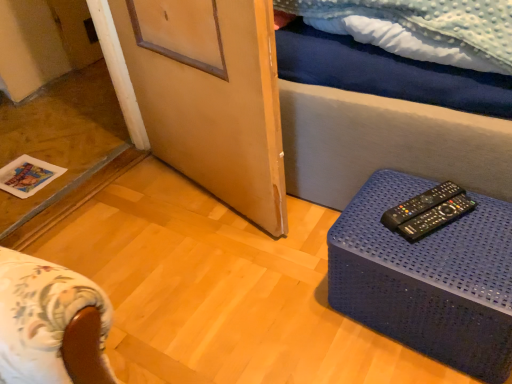
Question: Looking at the image, does blue plastic table at lower right seem bigger or smaller compared to black plastic remote control at right, positioned as the 1th remote control in back-to-front order?

Choices:
 (A) small
 (B) big

Answer: (B)

Question: In the image, is blue plastic table at lower right on the left side or the right side of black plastic remote control at right, the 2th remote control when ordered from front to back?

Choices:
 (A) right
 (B) left

Answer: (A)

Question: Considering the real-world distances, which object is farthest from the wooden screen door at center?

Choices:
 (A) black plastic remote controls at right, arranged as the 2th remote control when viewed from the back
 (B) black plastic remote control at right, positioned as the 1th remote control in back-to-front order
 (C) blue plastic table at lower right

Answer: (A)

Question: Estimate the real-world distances between objects in this image. Which object is farther from the black plastic remote controls at right, which ranks as the 1th remote control in front-to-back order?

Choices:
 (A) black plastic remote control at right, the 2th remote control when ordered from front to back
 (B) wooden screen door at center
 (C) blue plastic table at lower right

Answer: (B)